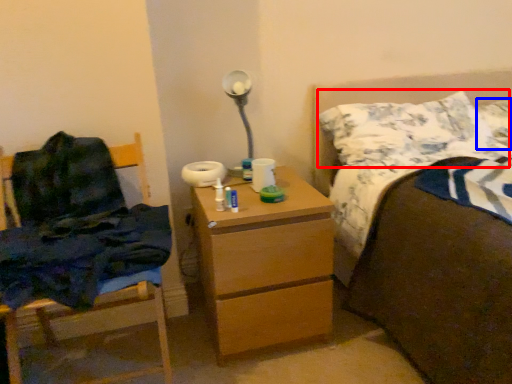
Question: Among these objects, which one is nearest to the camera, pillow (highlighted by a red box) or pillow (highlighted by a blue box)?

Choices:
 (A) pillow
 (B) pillow

Answer: (A)